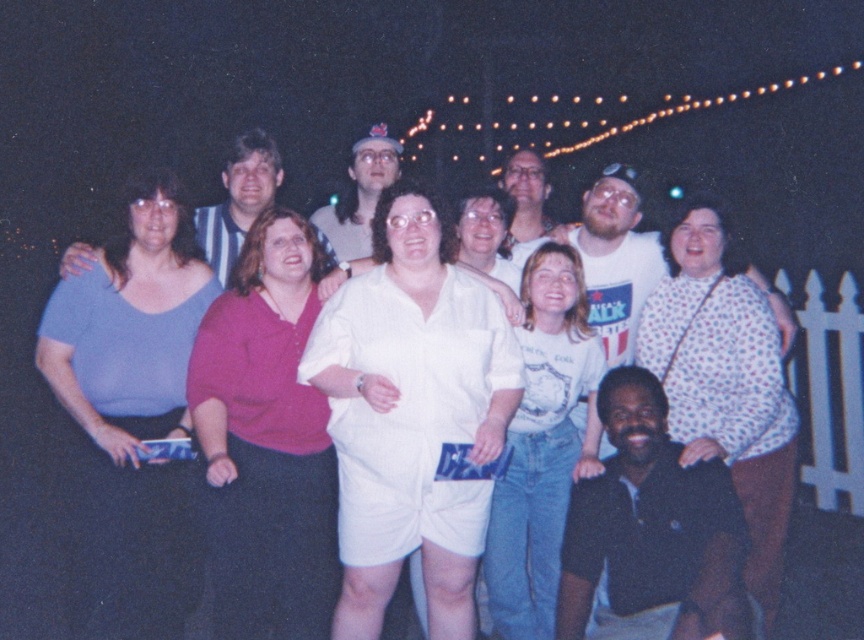
You are a photographer trying to capture the group photo. You notice the white dotted blouse at center and the matte blue shirt at left. Which clothing item is closer to the bottom of the image?

The white dotted blouse at center is positioned under the matte blue shirt at left, so it is closer to the bottom of the image.

You are standing at the center of the group and see the point marked at coordinates [411,413]. What is this point located on?

The point marked at coordinates [411,413] is located on the white pinstripe shorts at center.